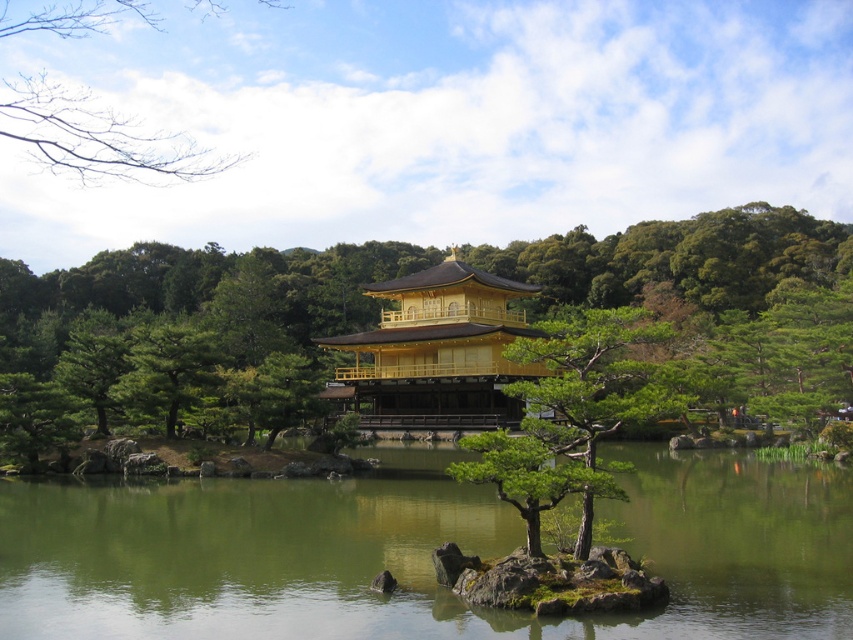
Which of these two, green liquid water at center or bare branches at upper left, stands taller?

bare branches at upper left

Does green liquid water at center appear over bare branches at upper left?

Actually, green liquid water at center is below bare branches at upper left.

Who is more forward, (161,536) or (10,115)?

Point (161,536)

You are a GUI agent. You are given a task and a screenshot of the screen. Output one action in this format:
    pyautogui.click(x=<x>, y=<y>)
    Task: Click on the green liquid water at center
    The width and height of the screenshot is (853, 640).
    Given the screenshot: What is the action you would take?
    pyautogui.click(x=419, y=552)

Between point (634, 408) and point (49, 28), which one is positioned behind?

Point (49, 28)

Can you confirm if green glossy tree at center is positioned to the right of bare branches at upper left?

Indeed, green glossy tree at center is positioned on the right side of bare branches at upper left.

The height and width of the screenshot is (640, 853). I want to click on green glossy tree at center, so [x=572, y=413].

Does green liquid water at center lie behind golden polished wood temple at center?

No.

Who is taller, green liquid water at center or golden polished wood temple at center?

With more height is golden polished wood temple at center.

Measure the distance between point (817, 522) and camera.

The distance of point (817, 522) from camera is 34.58 meters.

The width and height of the screenshot is (853, 640). Find the location of `green liquid water at center`. green liquid water at center is located at coordinates (419, 552).